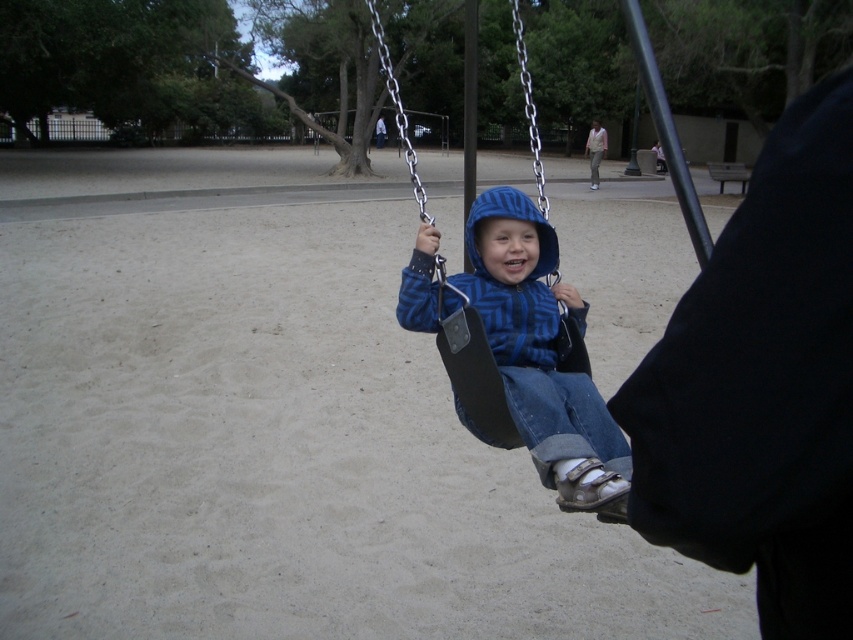
Does blue fleece hoodie at center come behind black plastic swing at center?

No.

Does point (476, 224) lie in front of point (523, 61)?

Yes.

Find the location of `blue fleece hoodie at center`. blue fleece hoodie at center is located at coordinates click(x=541, y=353).